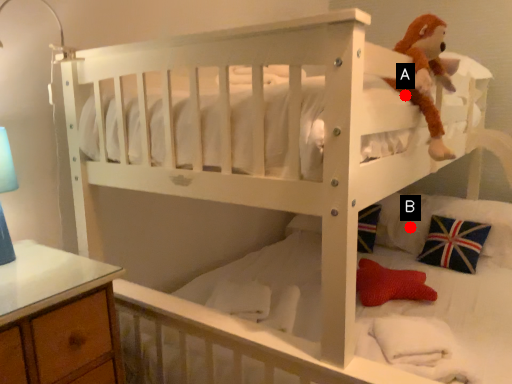
Question: Two points are circled on the image, labeled by A and B beside each circle. Which point is farther to the camera?

Choices:
 (A) A is further
 (B) B is further

Answer: (B)